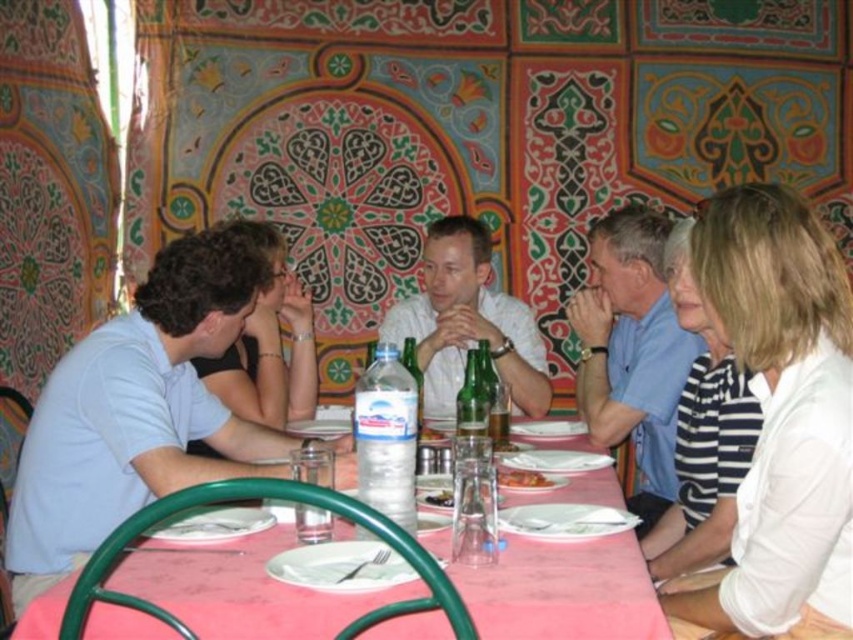
Question: Among these objects, which one is farthest from the camera?

Choices:
 (A) pink fabric table at center
 (B) light blue cotton shirt at left
 (C) clear glass water at table center

Answer: (B)

Question: Where is white matte shirt at center located in relation to green glass bottle at center in the image?

Choices:
 (A) left
 (B) right

Answer: (A)

Question: Does white cotton shirt at upper right appear on the left side of pink fabric table at center?

Choices:
 (A) yes
 (B) no

Answer: (B)

Question: From the image, what is the correct spatial relationship of pink fabric table at center in relation to white striped shirt at right?

Choices:
 (A) below
 (B) above

Answer: (A)

Question: Among these objects, which one is nearest to the camera?

Choices:
 (A) white cotton shirt at upper right
 (B) white matte shirt at center

Answer: (A)

Question: Which point appears farthest from the camera in this image?

Choices:
 (A) (526, 470)
 (B) (381, 483)
 (C) (631, 234)

Answer: (C)